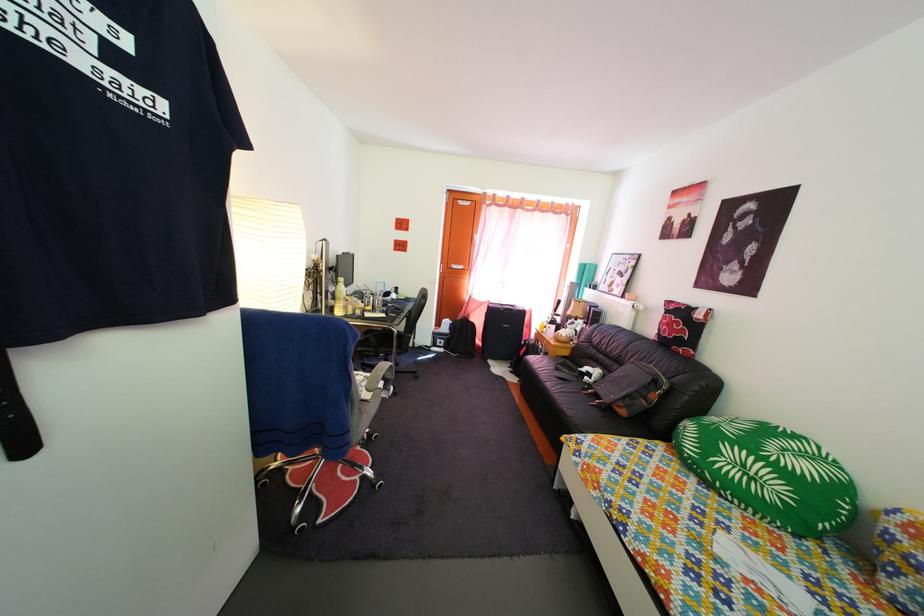
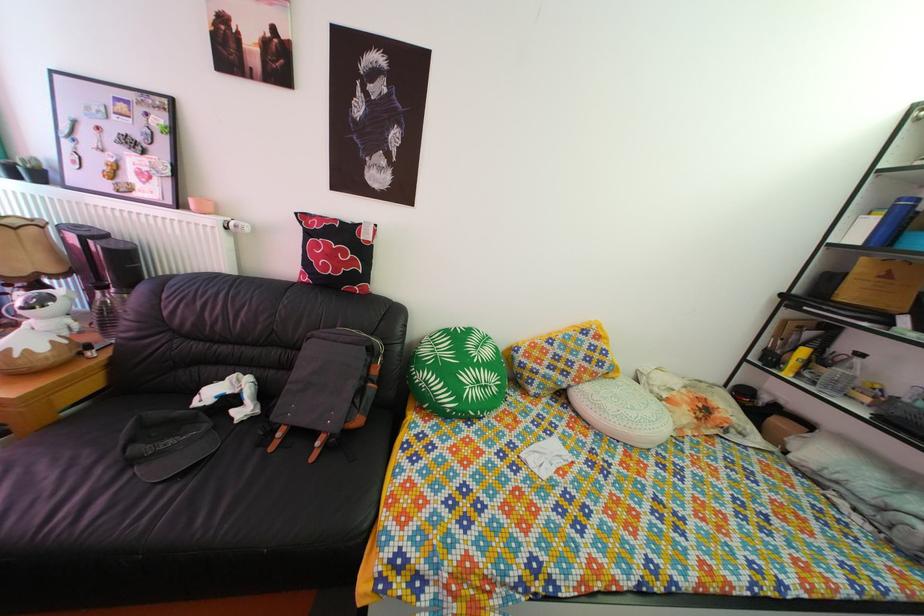
The point at (762, 487) is marked in the first image. Where is the corresponding point in the second image?

(494, 395)